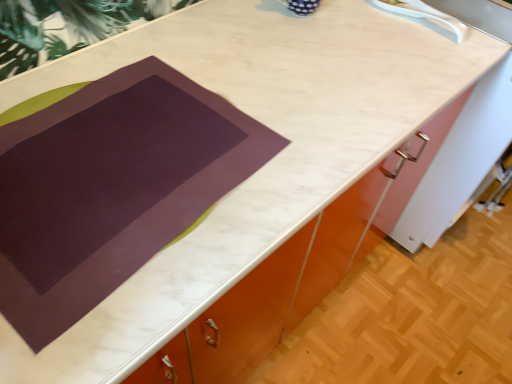
Question: From the image's perspective, is purple matte placemat at center located above or below white plastic sink at upper right?

Choices:
 (A) below
 (B) above

Answer: (A)

Question: Is purple matte placemat at center bigger or smaller than white plastic sink at upper right?

Choices:
 (A) small
 (B) big

Answer: (B)

Question: In the image, is purple matte placemat at center on the left side or the right side of white plastic sink at upper right?

Choices:
 (A) left
 (B) right

Answer: (A)

Question: Considering the positions of point (498, 6) and point (64, 124), is point (498, 6) closer or farther from the camera than point (64, 124)?

Choices:
 (A) closer
 (B) farther

Answer: (B)

Question: Considering the positions of white plastic sink at upper right and purple matte placemat at center in the image, is white plastic sink at upper right bigger or smaller than purple matte placemat at center?

Choices:
 (A) small
 (B) big

Answer: (A)

Question: Based on their positions, is white plastic sink at upper right located to the left or right of purple matte placemat at center?

Choices:
 (A) left
 (B) right

Answer: (B)

Question: From a real-world perspective, is white plastic sink at upper right above or below purple matte placemat at center?

Choices:
 (A) below
 (B) above

Answer: (B)